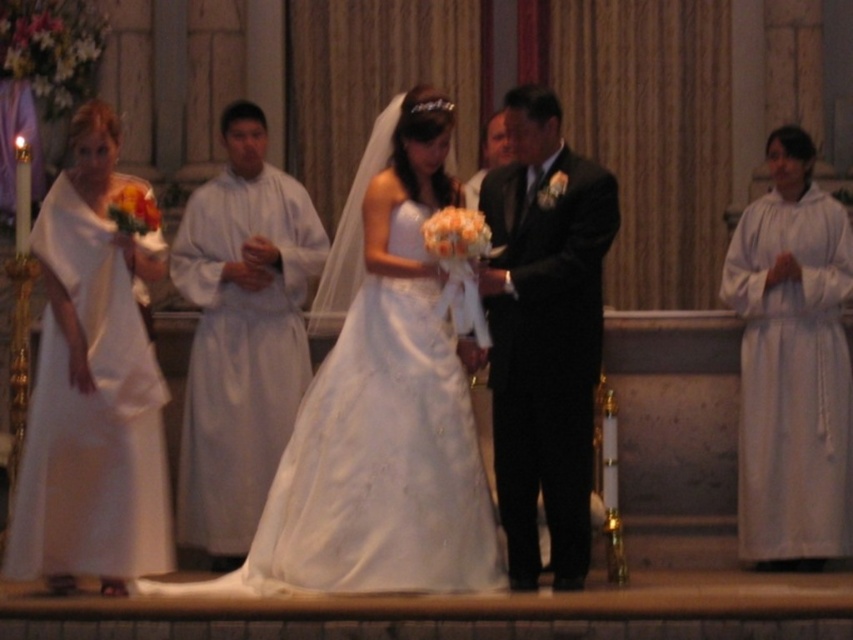
Based on the scene description, can you determine the spatial relationship between the shiny black suit at center and the white cloth at right?

The shiny black suit at center is located below the white cloth at right.